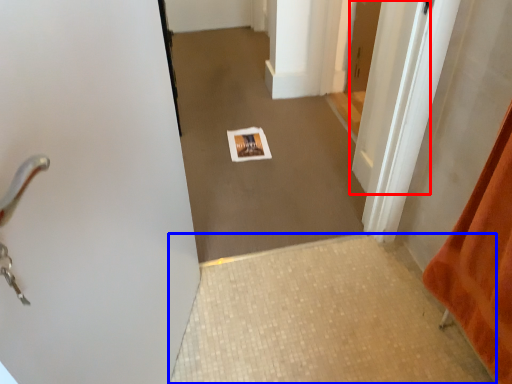
Question: Which point is further to the camera, door (highlighted by a red box) or tile (highlighted by a blue box)?

Choices:
 (A) door
 (B) tile

Answer: (A)